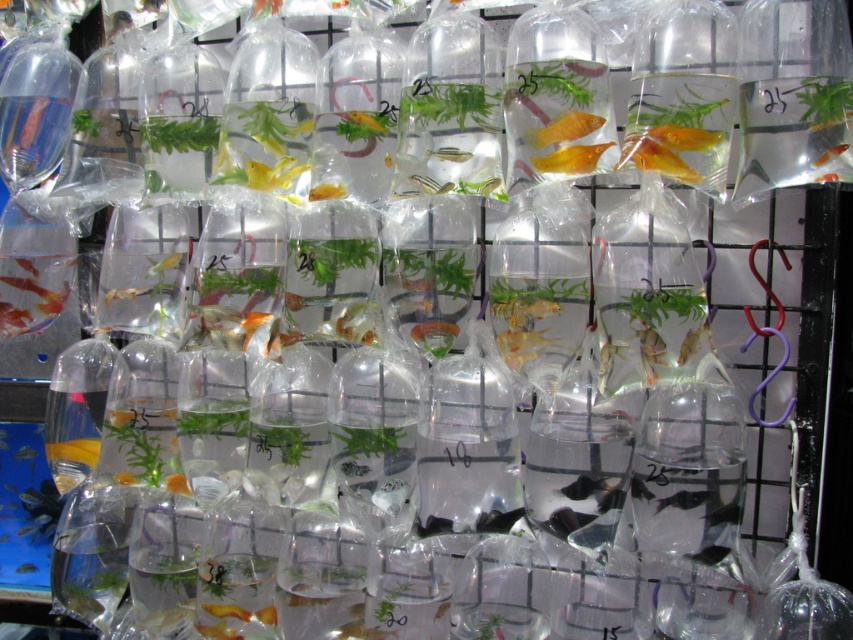
You are standing in front of a black metal shelving unit with several plastic bags filled with water, goldfish, and plants arranged in a grid. You notice a translucent plastic goldfish at center. Can you determine its exact position using the coordinate system provided?

The translucent plastic goldfish at center is located at point (450, 154) according to the coordinate system provided.

You are standing in front of the shelving unit with the plastic bags. You want to pick up the item at point (440,157) without disturbing the one at point (433,189). Which point should you reach for first?

You should reach for point (440,157) first because it is closer to you than point (433,189), so you can grab it without affecting the other.

You are a customer at a pet store and see the translucent plastic goldfish at center and the translucent plastic fish at center. How far apart are these two items?

The translucent plastic goldfish at center and the translucent plastic fish at center are 1.16 inches apart.